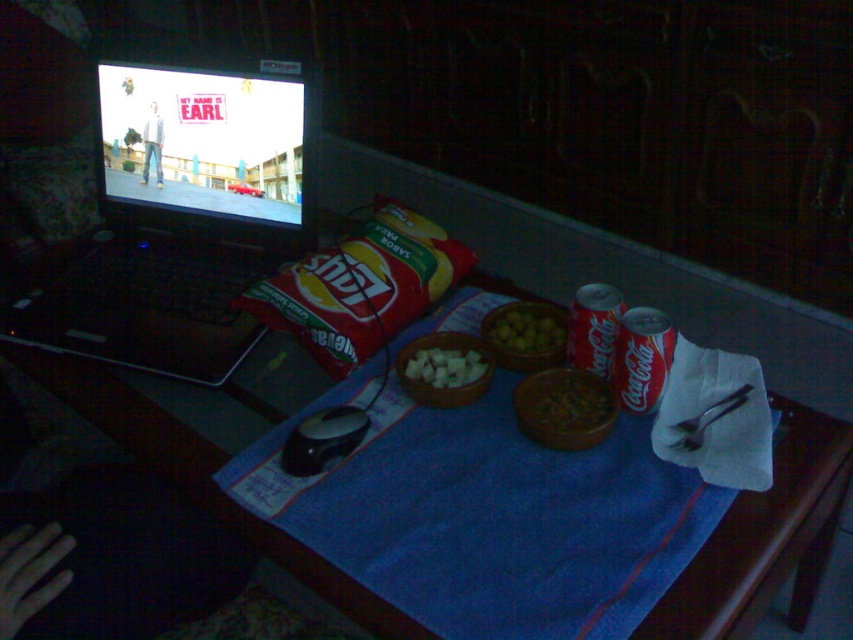
Question: Is black plastic laptop at upper left further to the viewer compared to coca-cola can at center?

Choices:
 (A) no
 (B) yes

Answer: (B)

Question: Estimate the real-world distances between objects in this image. Which object is closer to the white matte potato at center?

Choices:
 (A) white paper towel at right
 (B) coca-cola can at right

Answer: (B)

Question: Is green matte olives at center to the left of white matte potato at center from the viewer's perspective?

Choices:
 (A) no
 (B) yes

Answer: (A)

Question: Which point is farther to the camera?

Choices:
 (A) (590, 312)
 (B) (631, 316)
 (C) (549, 429)
 (D) (152, 141)

Answer: (D)

Question: Which of the following is the farthest from the observer?

Choices:
 (A) coca-cola can at center
 (B) black plastic laptop at upper left

Answer: (B)

Question: From the image, what is the correct spatial relationship of black plastic laptop at upper left in relation to green matte olives at center?

Choices:
 (A) below
 (B) above

Answer: (B)